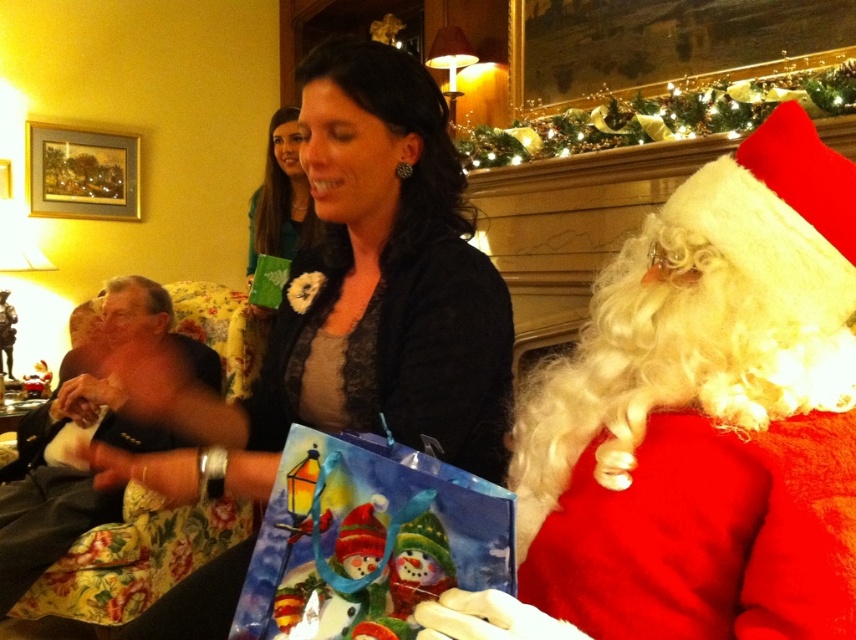
Question: Is red fluffy santa at right thinner than dark gray fabric suit at left?

Choices:
 (A) no
 (B) yes

Answer: (B)

Question: Which point is closer to the camera taking this photo?

Choices:
 (A) (453, 492)
 (B) (302, 195)
 (C) (102, 380)
 (D) (464, 404)

Answer: (A)

Question: Does watercolor paper bag at center come behind dark gray fabric suit at left?

Choices:
 (A) yes
 (B) no

Answer: (B)

Question: Which of these objects is positioned closest to the red fluffy santa at right?

Choices:
 (A) matte black sweater at center
 (B) matte green fabric at upper center

Answer: (A)

Question: Does watercolor paper bag at center have a lesser width compared to dark gray fabric suit at left?

Choices:
 (A) no
 (B) yes

Answer: (B)

Question: Which point is farther from the camera taking this photo?

Choices:
 (A) coord(268,472)
 (B) coord(330,508)
 (C) coord(277,164)

Answer: (C)